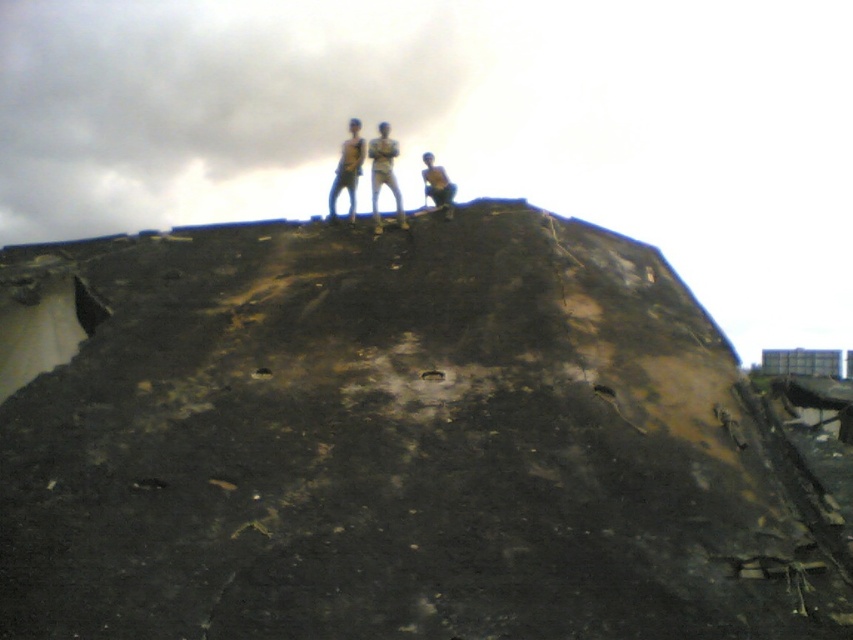
Question: Which point is farther to the camera?

Choices:
 (A) brown leather jacket at upper center
 (B) light brown jeans at center
 (C) light brown skin at center

Answer: (C)

Question: Among these points, which one is farthest from the camera?

Choices:
 (A) (450, 193)
 (B) (328, 202)
 (C) (378, 138)

Answer: (A)

Question: Can you confirm if charcoal textured mound at upper center is smaller than brown leather jacket at upper center?

Choices:
 (A) yes
 (B) no

Answer: (B)

Question: Which object appears closest to the camera in this image?

Choices:
 (A) brown leather jacket at upper center
 (B) light brown skin at center
 (C) charcoal textured mound at upper center
 (D) light brown jeans at center

Answer: (C)

Question: From the image, what is the correct spatial relationship of light brown skin at center in relation to brown leather jacket at upper center?

Choices:
 (A) above
 (B) below

Answer: (A)

Question: Is light brown jeans at center below light brown skin at center?

Choices:
 (A) no
 (B) yes

Answer: (B)